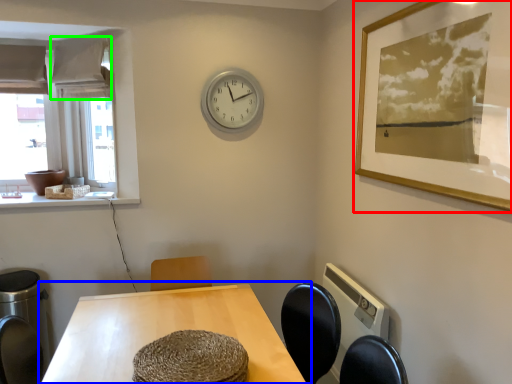
Question: Which object is positioned closest to picture frame (highlighted by a red box)? Select from table (highlighted by a blue box) and curtain (highlighted by a green box).

Choices:
 (A) table
 (B) curtain

Answer: (A)